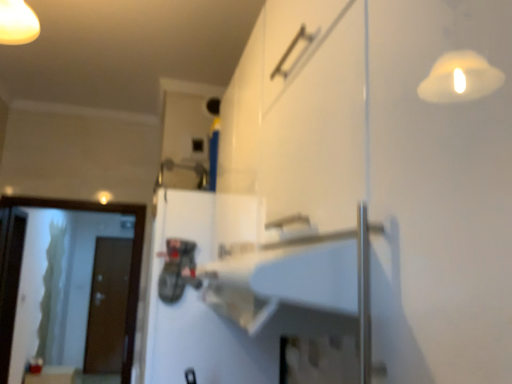
Question: In which direction should I rotate to look at white matte door at center, which ranks as the 2th door in back-to-front order?

Choices:
 (A) left
 (B) right

Answer: (A)

Question: Is transparent glass screen door at left, the 1th screen door positioned from the back, taller than white glossy screen door at left, which appears as the 1th screen door when viewed from the right?

Choices:
 (A) no
 (B) yes

Answer: (B)

Question: Is white glossy screen door at left, which appears as the 1th screen door when viewed from the right, surrounded by transparent glass screen door at left, the second screen door in the right-to-left sequence?

Choices:
 (A) yes
 (B) no

Answer: (B)

Question: From the image's perspective, is transparent glass screen door at left, which is counted as the first screen door, starting from the left, located beneath white glossy screen door at left, which appears as the 1th screen door when viewed from the right?

Choices:
 (A) no
 (B) yes

Answer: (B)

Question: Is transparent glass screen door at left, the 1th screen door positioned from the back, far away from white glossy screen door at left, placed as the second screen door when sorted from back to front?

Choices:
 (A) no
 (B) yes

Answer: (B)

Question: Is transparent glass screen door at left, acting as the 2th screen door starting from the front, to the right of white glossy screen door at left, the first screen door in the front-to-back sequence, from the viewer's perspective?

Choices:
 (A) no
 (B) yes

Answer: (A)

Question: Is transparent glass screen door at left, acting as the 2th screen door starting from the front, oriented towards white glossy screen door at left, the 2th screen door in the left-to-right sequence?

Choices:
 (A) no
 (B) yes

Answer: (A)

Question: Is white glossy screen door at left, the 2th screen door in the left-to-right sequence, shorter than brown matte door at left, the first door when ordered from bottom to top?

Choices:
 (A) no
 (B) yes

Answer: (B)

Question: Does white glossy screen door at left, the first screen door in the front-to-back sequence, have a larger size compared to brown matte door at left, which ranks as the first door in back-to-front order?

Choices:
 (A) no
 (B) yes

Answer: (A)

Question: From a real-world perspective, is white glossy screen door at left, the 2th screen door in the left-to-right sequence, beneath brown matte door at left, which is counted as the second door, starting from the right?

Choices:
 (A) no
 (B) yes

Answer: (A)

Question: Considering the relative sizes of white glossy screen door at left, which appears as the 1th screen door when viewed from the right, and brown matte door at left, the first door when ordered from bottom to top, in the image provided, is white glossy screen door at left, which appears as the 1th screen door when viewed from the right, smaller than brown matte door at left, the first door when ordered from bottom to top,?

Choices:
 (A) no
 (B) yes

Answer: (B)

Question: Considering the relative sizes of white glossy screen door at left, placed as the second screen door when sorted from back to front, and brown matte door at left, which ranks as the first door in back-to-front order, in the image provided, is white glossy screen door at left, placed as the second screen door when sorted from back to front, wider than brown matte door at left, which ranks as the first door in back-to-front order,?

Choices:
 (A) no
 (B) yes

Answer: (B)

Question: Is white glossy screen door at left, the 2th screen door in the left-to-right sequence, directly adjacent to brown matte door at left, which ranks as the first door in left-to-right order?

Choices:
 (A) yes
 (B) no

Answer: (B)

Question: Is brown matte door at left, the first door when ordered from bottom to top, facing away from white glossy screen door at left, the 2th screen door in the left-to-right sequence?

Choices:
 (A) yes
 (B) no

Answer: (B)